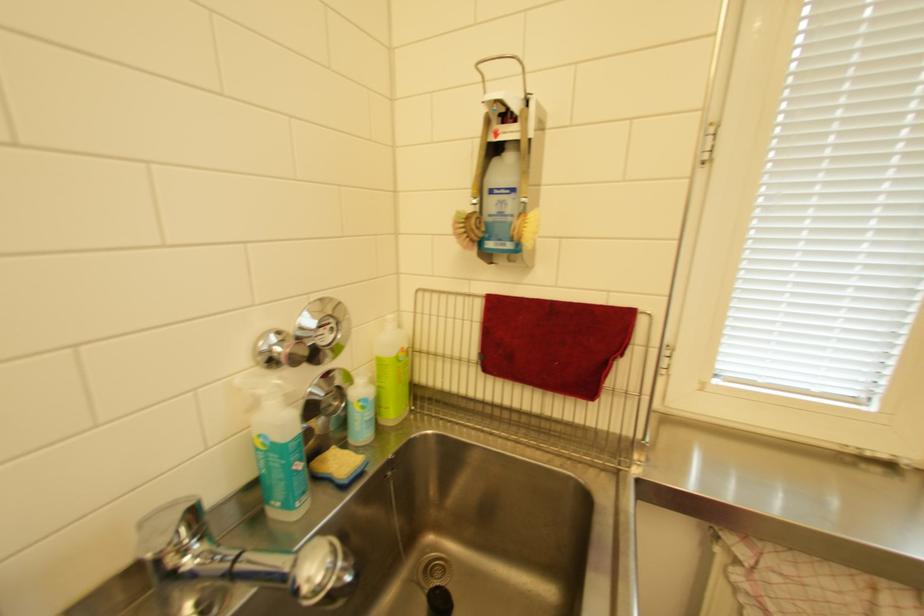
Where would you lift the small cleaning bottle? Please return your answer as a coordinate pair (x, y).

(360, 408)